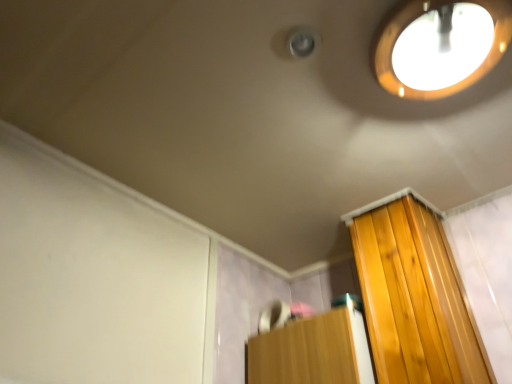
Question: Based on their sizes in the image, would you say wooden cabinet at lower right is bigger or smaller than matte wooden droplight at upper right?

Choices:
 (A) big
 (B) small

Answer: (A)

Question: In terms of width, does wooden cabinet at lower right look wider or thinner when compared to matte wooden droplight at upper right?

Choices:
 (A) thin
 (B) wide

Answer: (B)

Question: Which is nearer to the matte wooden droplight at upper right?

Choices:
 (A) wooden cabinet at lower right
 (B) white matte screen door at upper left

Answer: (A)

Question: Which object is positioned closest to the matte wooden droplight at upper right?

Choices:
 (A) wooden cabinet at lower right
 (B) white matte screen door at upper left

Answer: (A)